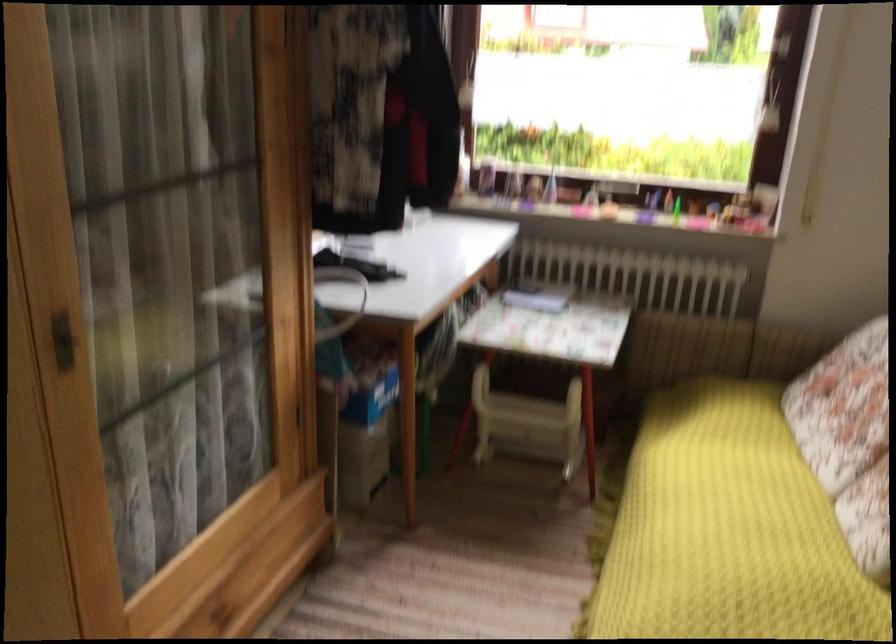
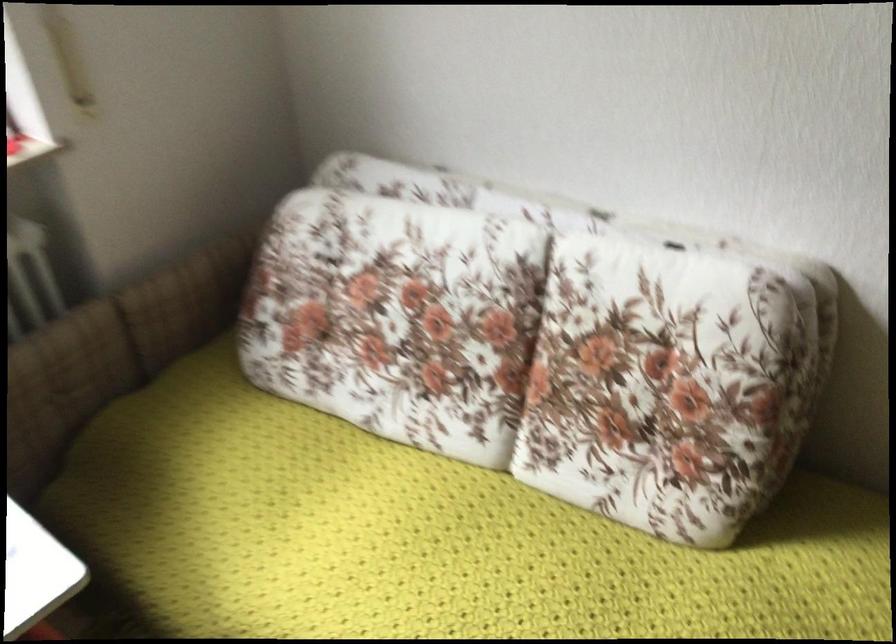
Find the pixel in the second image that matches [747,475] in the first image.

(429, 538)